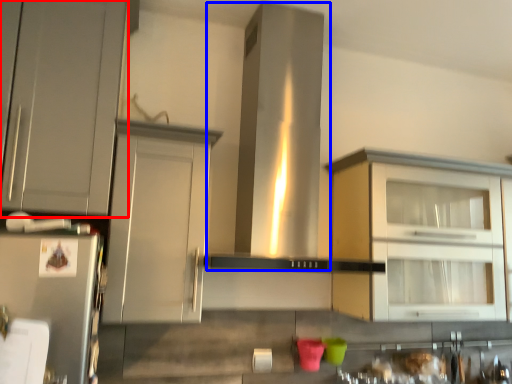
Question: Among these objects, which one is farthest to the camera, cabinetry (highlighted by a red box) or vent (highlighted by a blue box)?

Choices:
 (A) cabinetry
 (B) vent

Answer: (B)